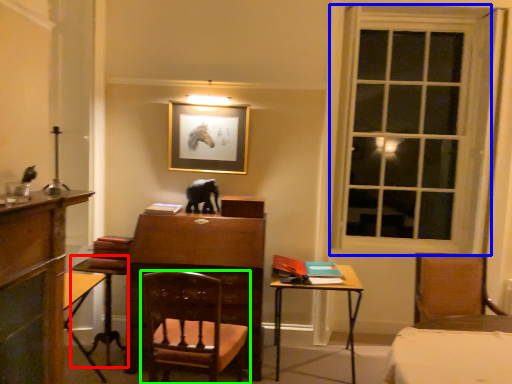
Question: Which object is the farthest from table (highlighted by a red box)? Choose among these: window (highlighted by a blue box) or chair (highlighted by a green box).

Choices:
 (A) window
 (B) chair

Answer: (A)